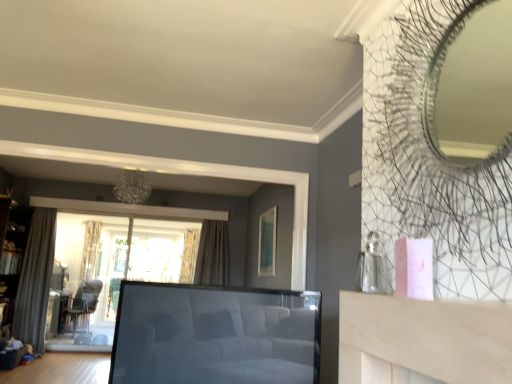
The width and height of the screenshot is (512, 384). Describe the element at coordinates (215, 335) in the screenshot. I see `white leather studio couch at center` at that location.

Describe the element at coordinates (104, 262) in the screenshot. I see `transparent glass window at center` at that location.

What do you see at coordinates (35, 280) in the screenshot?
I see `gray fabric curtain at left, the second curtain positioned from the left` at bounding box center [35, 280].

I want to click on silky gray curtain at left, the 3th curtain viewed from the front, so click(x=90, y=250).

In order to face beige fabric curtain at center, which is counted as the second curtain, starting from the front, should I rotate leftwards or rightwards?

You should rotate left by 6.554 degrees.

The width and height of the screenshot is (512, 384). Describe the element at coordinates (213, 254) in the screenshot. I see `beige fabric curtain at center, marked as the first curtain in a right-to-left arrangement` at that location.

I want to click on white leather studio couch at center, so click(215, 335).

Identify the location of the 2nd curtain to the right when counting from the wooden bookshelf at left. (189, 255).

Is wooden bookshelf at left inside patterned fabric curtain at center, the 3th curtain in the left-to-right sequence?

No.

Considering the relative sizes of patterned fabric curtain at center, marked as the second curtain in a right-to-left arrangement, and wooden bookshelf at left in the image provided, is patterned fabric curtain at center, marked as the second curtain in a right-to-left arrangement, taller than wooden bookshelf at left?

No, patterned fabric curtain at center, marked as the second curtain in a right-to-left arrangement, is not taller than wooden bookshelf at left.

From a real-world perspective, is gray fabric curtain at left, which is counted as the first curtain, starting from the front, located higher than beige fabric curtain at center, which is counted as the second curtain, starting from the front?

Incorrect, from a real-world perspective, gray fabric curtain at left, which is counted as the first curtain, starting from the front, is lower than beige fabric curtain at center, which is counted as the second curtain, starting from the front.

Considering the relative sizes of gray fabric curtain at left, which is counted as the third curtain, starting from the right, and beige fabric curtain at center, marked as the first curtain in a right-to-left arrangement, in the image provided, is gray fabric curtain at left, which is counted as the third curtain, starting from the right, bigger than beige fabric curtain at center, marked as the first curtain in a right-to-left arrangement,?

Yes, gray fabric curtain at left, which is counted as the third curtain, starting from the right, is bigger than beige fabric curtain at center, marked as the first curtain in a right-to-left arrangement.

Considering the sizes of white leather studio couch at center and transparent glass window at center in the image, is white leather studio couch at center wider or thinner than transparent glass window at center?

Clearly, white leather studio couch at center has more width compared to transparent glass window at center.

From the image's perspective, which one is positioned higher, white leather studio couch at center or transparent glass window at center?

white leather studio couch at center is shown above in the image.

From a real-world perspective, which object stands above the other?

transparent glass window at center is physically above.

Based on the photo, is white leather studio couch at center with transparent glass window at center?

white leather studio couch at center and transparent glass window at center are clearly separated.

Is point (205, 249) positioned behind point (184, 261)?

No, (205, 249) is in front of (184, 261).

Is patterned fabric curtain at center, the 4th curtain when ordered from front to back, surrounded by beige fabric curtain at center, arranged as the 3th curtain when viewed from the back?

No, patterned fabric curtain at center, the 4th curtain when ordered from front to back, is not a part of beige fabric curtain at center, arranged as the 3th curtain when viewed from the back.

You are a GUI agent. You are given a task and a screenshot of the screen. Output one action in this format:
    pyautogui.click(x=<x>, y=<y>)
    Task: Click on the curtain that is on the right side of patterned fabric curtain at center, the 3th curtain in the left-to-right sequence
    This screenshot has width=512, height=384.
    Given the screenshot: What is the action you would take?
    [x=213, y=254]

In the image, is beige fabric curtain at center, which is counted as the second curtain, starting from the front, positioned in front of or behind patterned fabric curtain at center, marked as the second curtain in a right-to-left arrangement?

beige fabric curtain at center, which is counted as the second curtain, starting from the front, is in front of patterned fabric curtain at center, marked as the second curtain in a right-to-left arrangement.

Can you confirm if clear glass window screen at center is smaller than silky gray curtain at left, the 1th curtain positioned from the left?

Actually, clear glass window screen at center might be larger than silky gray curtain at left, the 1th curtain positioned from the left.

The image size is (512, 384). What are the coordinates of `the 1st curtain in front of the clear glass window screen at center` in the screenshot? It's located at (90, 250).

Does clear glass window screen at center appear on the right side of silky gray curtain at left, which is the 2th curtain in back-to-front order?

Indeed, clear glass window screen at center is positioned on the right side of silky gray curtain at left, which is the 2th curtain in back-to-front order.

Could you tell me if clear glass window screen at center is turned towards silky gray curtain at left, which is the 2th curtain in back-to-front order?

No.

Looking at their sizes, would you say matte green picture frame at upper center is wider or thinner than wooden bookshelf at left?

Considering their sizes, matte green picture frame at upper center looks slimmer than wooden bookshelf at left.

Consider the image. From a real-world perspective, is matte green picture frame at upper center below wooden bookshelf at left?

No.

Which is closer to the camera, (x=264, y=261) or (x=10, y=276)?

Point (x=264, y=261) is positioned closer to the camera compared to point (x=10, y=276).

Is wooden bookshelf at left completely or partially inside matte green picture frame at upper center?

No, wooden bookshelf at left is located outside of matte green picture frame at upper center.

Does silky gray curtain at left, which is the 2th curtain in back-to-front order, lie behind white leather studio couch at center?

Yes, it is.

Looking at this image, from a real-world perspective, who is located lower, silky gray curtain at left, the 1th curtain positioned from the left, or white leather studio couch at center?

From a 3D spatial view, white leather studio couch at center is below.

Are silky gray curtain at left, which is the 2th curtain in back-to-front order, and white leather studio couch at center beside each other?

silky gray curtain at left, which is the 2th curtain in back-to-front order, and white leather studio couch at center are not in contact.

From the image's perspective, is silky gray curtain at left, the 1th curtain positioned from the left, positioned above or below white leather studio couch at center?

Based on their image positions, silky gray curtain at left, the 1th curtain positioned from the left, is located beneath white leather studio couch at center.

The width and height of the screenshot is (512, 384). I want to click on shelf on the left of the patterned fabric curtain at center, the 4th curtain when ordered from front to back, so click(x=13, y=250).

The width and height of the screenshot is (512, 384). I want to click on the 1st curtain behind the gray fabric curtain at left, the second curtain positioned from the left, so point(213,254).

From the image, which object appears to be farther from white leather studio couch at center, transparent glass window at center or dark brown leather armchair at lower left?

dark brown leather armchair at lower left lies further to white leather studio couch at center than the other object.

Estimate the real-world distances between objects in this image. Which object is further from dark brown leather armchair at lower left, silky gray curtain at left, the 3th curtain viewed from the front, or wooden bookshelf at left?

Among the two, wooden bookshelf at left is located further to dark brown leather armchair at lower left.

When comparing their distances from silky gray curtain at left, the 1th curtain positioned from the left, does transparent glass window at center or dark brown leather armchair at lower left seem closer?

dark brown leather armchair at lower left is positioned closer to the anchor silky gray curtain at left, the 1th curtain positioned from the left.

Which object lies nearer to the anchor point beige fabric curtain at center, marked as the first curtain in a right-to-left arrangement, white leather studio couch at center or matte green picture frame at upper center?

Among the two, matte green picture frame at upper center is located nearer to beige fabric curtain at center, marked as the first curtain in a right-to-left arrangement.

From the image, which object appears to be farther from matte green picture frame at upper center, wooden bookshelf at left or clear glass window screen at center?

Based on the image, wooden bookshelf at left appears to be further to matte green picture frame at upper center.

Which object lies nearer to the anchor point transparent glass window at center, gray fabric curtain at left, which ranks as the 4th curtain in back-to-front order, or dark brown leather armchair at lower left?

dark brown leather armchair at lower left is positioned closer to the anchor transparent glass window at center.

Which object lies nearer to the anchor point silky gray curtain at left, the 3th curtain viewed from the front, patterned fabric curtain at center, which ranks as the 1th curtain in back-to-front order, or matte green picture frame at upper center?

patterned fabric curtain at center, which ranks as the 1th curtain in back-to-front order, is closer to silky gray curtain at left, the 3th curtain viewed from the front.

From the image, which object appears to be farther from gray fabric curtain at left, which is counted as the third curtain, starting from the right, wooden bookshelf at left or white leather studio couch at center?

The object further to gray fabric curtain at left, which is counted as the third curtain, starting from the right, is white leather studio couch at center.

The width and height of the screenshot is (512, 384). What are the coordinates of `armchair positioned between wooden bookshelf at left and silky gray curtain at left, the 1th curtain positioned from the left, from near to far` in the screenshot? It's located at (82, 307).

You are a GUI agent. You are given a task and a screenshot of the screen. Output one action in this format:
    pyautogui.click(x=<x>, y=<y>)
    Task: Click on the picture frame located between white leather studio couch at center and gray fabric curtain at left, the second curtain positioned from the left, in the depth direction
    The width and height of the screenshot is (512, 384).
    Given the screenshot: What is the action you would take?
    pyautogui.click(x=267, y=242)

Identify the location of window between white leather studio couch at center and beige fabric curtain at center, which is counted as the 4th curtain, starting from the left, along the z-axis. (104, 262).

Identify the location of armchair between gray fabric curtain at left, which is counted as the third curtain, starting from the right, and silky gray curtain at left, the 1th curtain positioned from the left, in the front-back direction. The width and height of the screenshot is (512, 384). (82, 307).